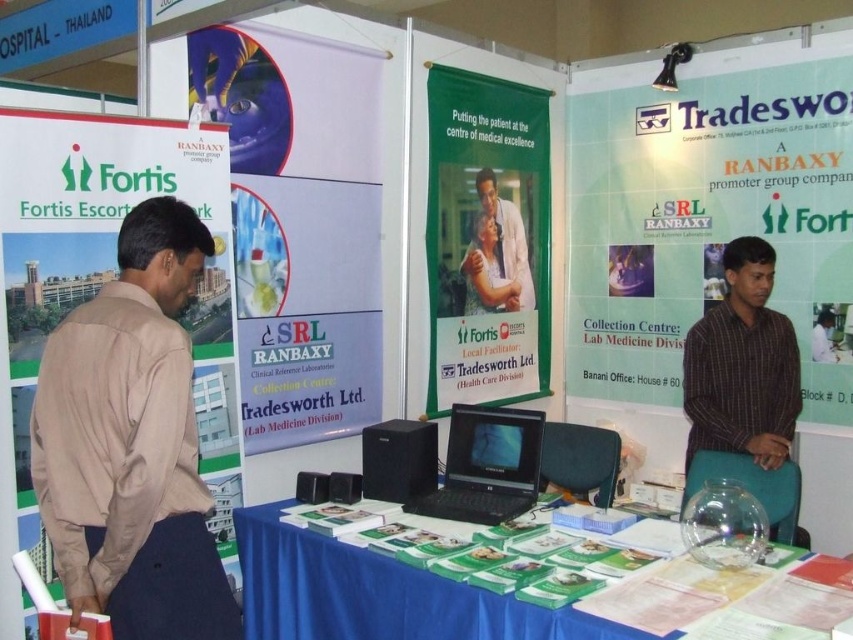
Based on the photo, you are a visitor at the trade show booth and see both the brown striped shirt at right and the white lab coat at center. Which clothing item is positioned more to the east side of the booth?

The brown striped shirt at right is positioned to the right of the white lab coat at center, so it is more to the east side of the booth.

You are a visitor at the trade show booth and see the green matte poster at right and the brown striped shirt at right. Which one is located more to the right side?

The green matte poster at right is more to the right side.

You are a visitor at the trade show booth and want to read the text on both the green matte poster at right and the black plastic laptop at center. Which one do you think has larger text? Please explain your reasoning based on their sizes.

The green matte poster at right is bigger than the black plastic laptop at center. Since the poster is larger, it likely has larger text to maintain readability, making the text on the green matte poster at right bigger than that on the black plastic laptop at center.